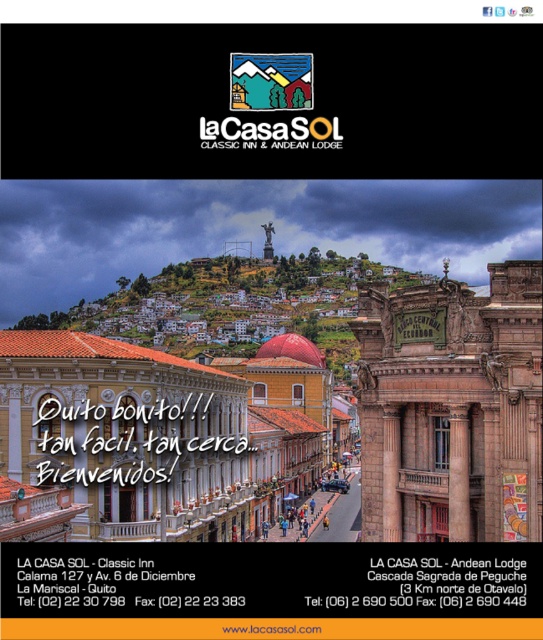
You are a tourist in Quito and want to take a photo of the brown stone building at center and the brown stone column at center. Which one appears wider in the photo?

The brown stone building at center appears wider than the brown stone column at center because its width surpasses the column.

You are a tourist in Quito and want to take a photo of both the brown stone building at center and the multicolored wooden house at upper center. Which one should you frame first in your camera to ensure both are visible in the photo?

You should frame the brown stone building at center first since it is wider than the multicolored wooden house at upper center, allowing more space for both in the photo.